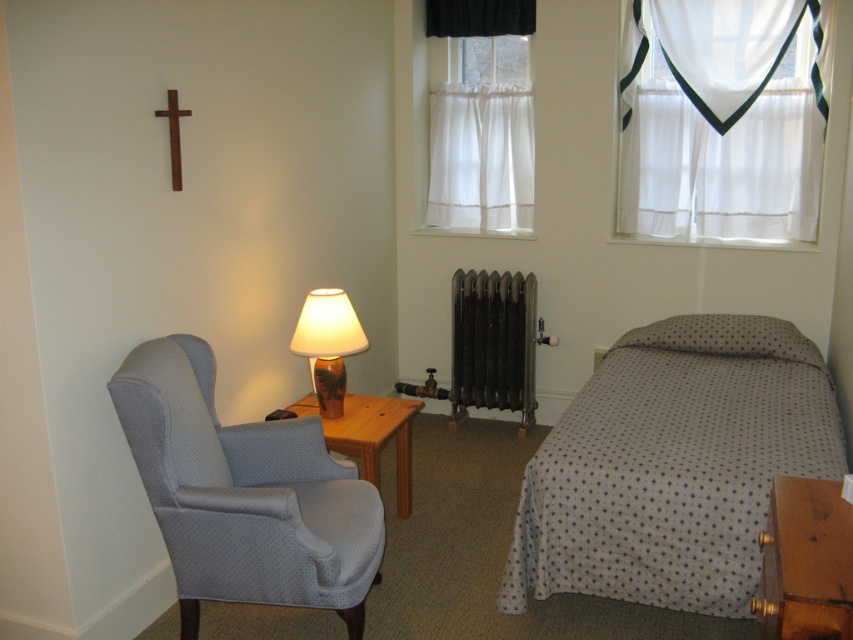
Is white dotted fabric bed at right above matte ceramic lamp at center?

No, white dotted fabric bed at right is not above matte ceramic lamp at center.

Does point (529, 554) come farther from viewer compared to point (334, 369)?

That is False.

Locate an element on the screen. This screenshot has width=853, height=640. white dotted fabric bed at right is located at coordinates (672, 465).

Is the position of dark gray metal radiator at center less distant than that of wooden side table at center?

No.

Between dark gray metal radiator at center and wooden side table at center, which one appears on the left side from the viewer's perspective?

wooden side table at center

Identify the location of dark gray metal radiator at center. This screenshot has width=853, height=640. (492, 342).

This screenshot has width=853, height=640. I want to click on dark gray metal radiator at center, so click(492, 342).

Between white dotted fabric bed at right and brown wooden cross at upper left, which one appears on the right side from the viewer's perspective?

white dotted fabric bed at right is more to the right.

Between point (605, 508) and point (180, 113), which one is positioned in front?

Point (605, 508) is more forward.

Identify the location of white dotted fabric bed at right. (672, 465).